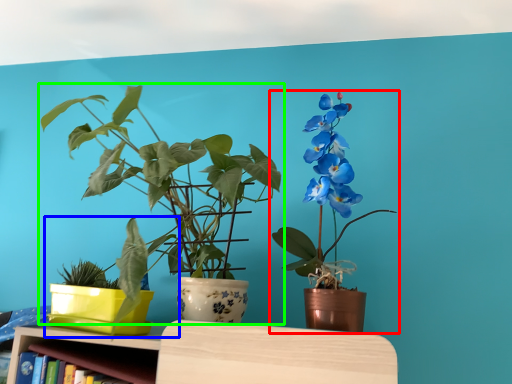
Question: Which object is the closest to the houseplant (highlighted by a red box)? Choose among these: houseplant (highlighted by a blue box) or houseplant (highlighted by a green box).

Choices:
 (A) houseplant
 (B) houseplant

Answer: (B)